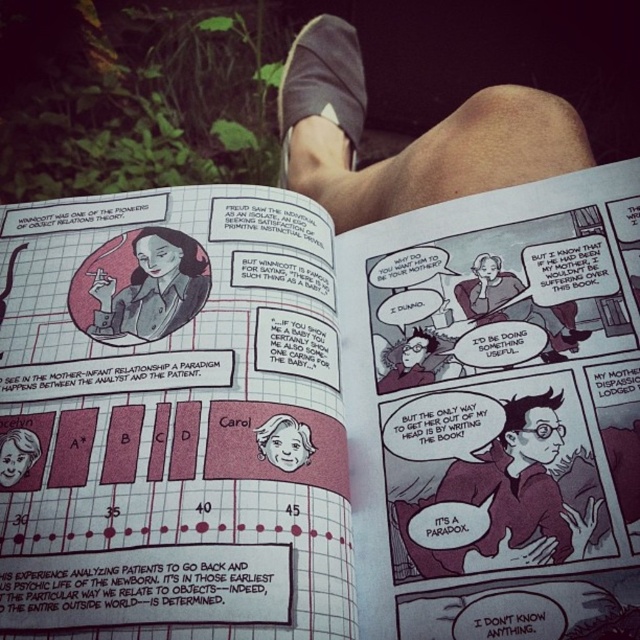
Who is positioned more to the left, matte brown jacket at center-left or smooth skin face at center?

From the viewer's perspective, matte brown jacket at center-left appears more on the left side.

Who is shorter, matte brown jacket at center-left or smooth skin face at center?

With less height is smooth skin face at center.

Is point (125, 298) less distant than point (296, 429)?

No, it is not.

I want to click on matte brown jacket at center-left, so coord(152,289).

Who is taller, matte brown jacket at center-left or smooth skin face at lower left?

matte brown jacket at center-left

From the picture: Between matte brown jacket at center-left and smooth skin face at lower left, which one appears on the left side from the viewer's perspective?

smooth skin face at lower left is more to the left.

Is point (189, 268) farther from camera compared to point (10, 472)?

That is True.

Identify the location of matte brown jacket at center-left. (152, 289).

Is matte black comic book page at center above smooth skin face at center?

Yes.

Consider the image. Is matte black comic book page at center wider than smooth skin face at center?

Yes.

The height and width of the screenshot is (640, 640). What are the coordinates of `matte black comic book page at center` in the screenshot? It's located at click(x=516, y=305).

Where is `matte black comic book page at center`? The image size is (640, 640). matte black comic book page at center is located at coordinates (516, 305).